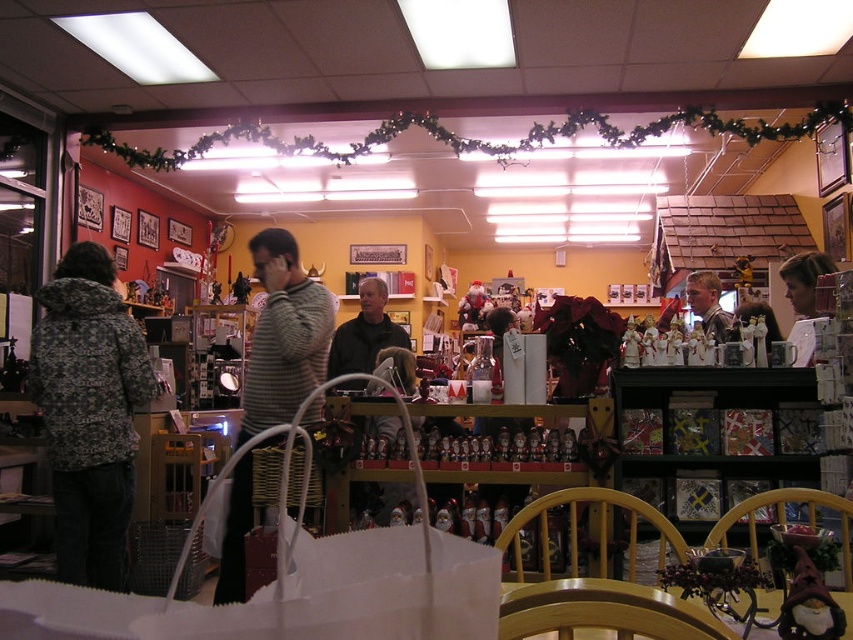
Question: Can you confirm if striped sweater at center is smaller than smooth gray sweater at center?

Choices:
 (A) no
 (B) yes

Answer: (A)

Question: Estimate the real-world distances between objects in this image. Which object is farther from the striped sweater at center?

Choices:
 (A) patterned fabric jacket at left
 (B) smooth gray sweater at center
 (C) dark gray sweater at center

Answer: (B)

Question: Can you confirm if patterned fabric jacket at left is positioned to the left of striped sweater at center?

Choices:
 (A) no
 (B) yes

Answer: (B)

Question: Estimate the real-world distances between objects in this image. Which object is closer to the smooth gray sweater at center?

Choices:
 (A) striped sweater at center
 (B) patterned fabric jacket at left
 (C) dark gray sweater at center

Answer: (C)

Question: Among these points, which one is farthest from the camera?

Choices:
 (A) coord(701,307)
 (B) coord(80,444)

Answer: (A)

Question: Is the position of patterned fabric jacket at left more distant than that of dark gray sweater at center?

Choices:
 (A) yes
 (B) no

Answer: (B)